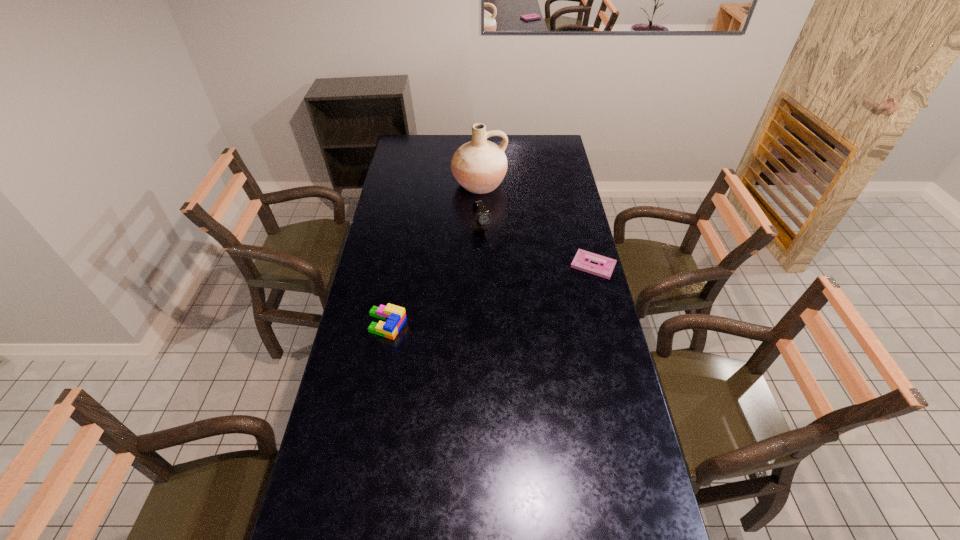
Image resolution: width=960 pixels, height=540 pixels. Find the location of `Lego`. Lego is located at coordinates (395, 316).

Where is `the leftmost object`? This screenshot has width=960, height=540. the leftmost object is located at coordinates (395, 316).

Identify the location of the rightmost object. The image size is (960, 540). (581, 261).

The width and height of the screenshot is (960, 540). I want to click on the shortest object, so pyautogui.click(x=581, y=261).

Identify the location of the tallest object. (479, 166).

Locate an element on the screen. This screenshot has width=960, height=540. pottery is located at coordinates (479, 166).

Image resolution: width=960 pixels, height=540 pixels. What are the coordinates of `the third shortest object` in the screenshot? It's located at (482, 217).

At what (x,y) coordinates should I click in order to perform the action: click on watch. Please return your answer as a coordinate pair (x, y). Image resolution: width=960 pixels, height=540 pixels. Looking at the image, I should click on (482, 217).

At what (x,y) coordinates should I click in order to perform the action: click on blank area located 0.240m on the right of the leftmost object. Please return your answer as a coordinate pair (x, y). The height and width of the screenshot is (540, 960). Looking at the image, I should click on (473, 324).

Locate an element on the screen. The width and height of the screenshot is (960, 540). vacant space located 0.300m on the left of the videotape is located at coordinates (495, 265).